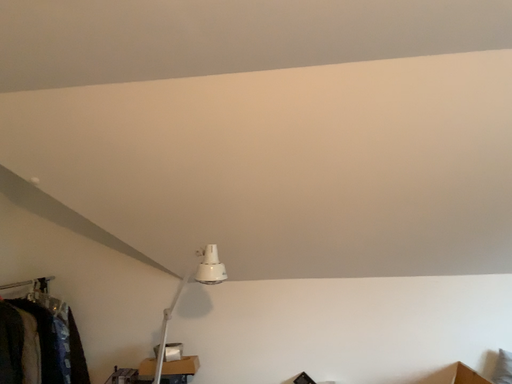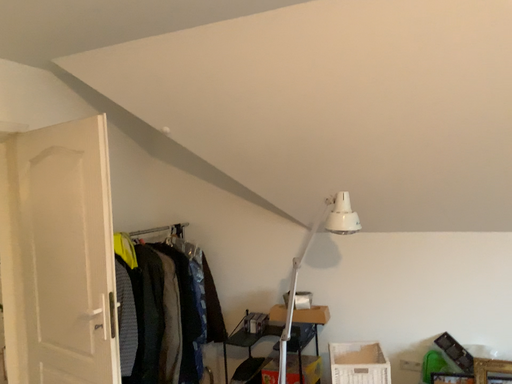
Question: Which way did the camera rotate in the video?

Choices:
 (A) rotated left
 (B) rotated right

Answer: (A)